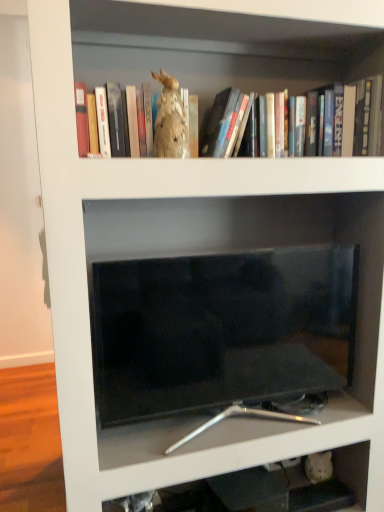
Question: Would you say beige fabric rabbit at upper center is to the left or to the right of black glossy tv at center in the picture?

Choices:
 (A) right
 (B) left

Answer: (B)

Question: From the image's perspective, is beige fabric rabbit at upper center located above or below black glossy tv at center?

Choices:
 (A) below
 (B) above

Answer: (B)

Question: Considering the real-world distances, which object is farthest from the beige fabric rabbit at upper center?

Choices:
 (A) black glossy tv at center
 (B) matte gold statue at upper center

Answer: (A)

Question: Which object is the closest to the matte gold statue at upper center?

Choices:
 (A) black glossy tv at center
 (B) beige fabric rabbit at upper center

Answer: (B)